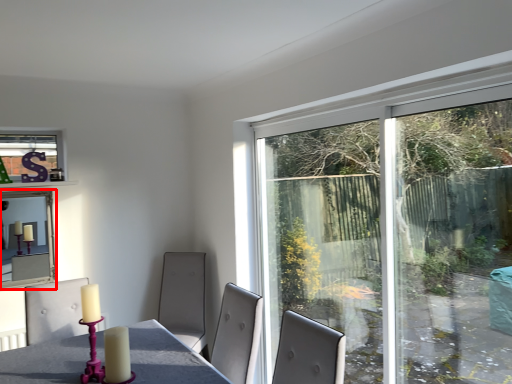
Question: From the image's perspective, what is the correct spatial relationship of window screen (annotated by the red box) in relation to window?

Choices:
 (A) above
 (B) below

Answer: (B)